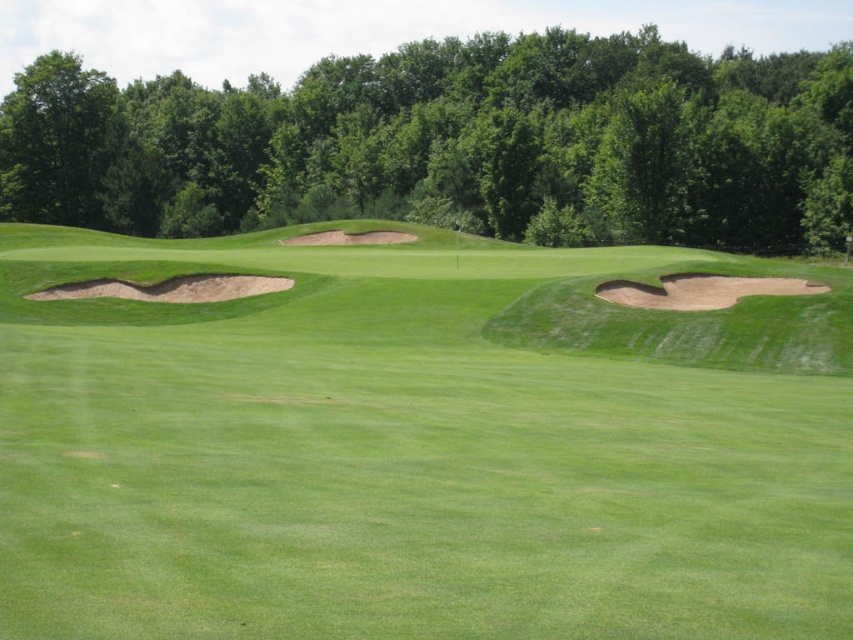
Question: Which point is closer to the camera?

Choices:
 (A) (525, 628)
 (B) (61, 296)
 (C) (659, 157)

Answer: (A)

Question: Is green grassy fairway at center to the right of sandy brown sand trap at left from the viewer's perspective?

Choices:
 (A) no
 (B) yes

Answer: (B)

Question: Does green grassy fairway at center have a lesser width compared to green leafy trees at upper center?

Choices:
 (A) yes
 (B) no

Answer: (A)

Question: Which object is the closest to the green leafy trees at upper center?

Choices:
 (A) green grassy fairway at center
 (B) sandy brown sand trap at left

Answer: (A)

Question: Does green leafy trees at upper center have a greater width compared to sandy brown sand trap at left?

Choices:
 (A) no
 (B) yes

Answer: (B)

Question: Which object is the closest to the green leafy trees at upper center?

Choices:
 (A) sandy brown sand trap at left
 (B) green grassy fairway at center

Answer: (B)